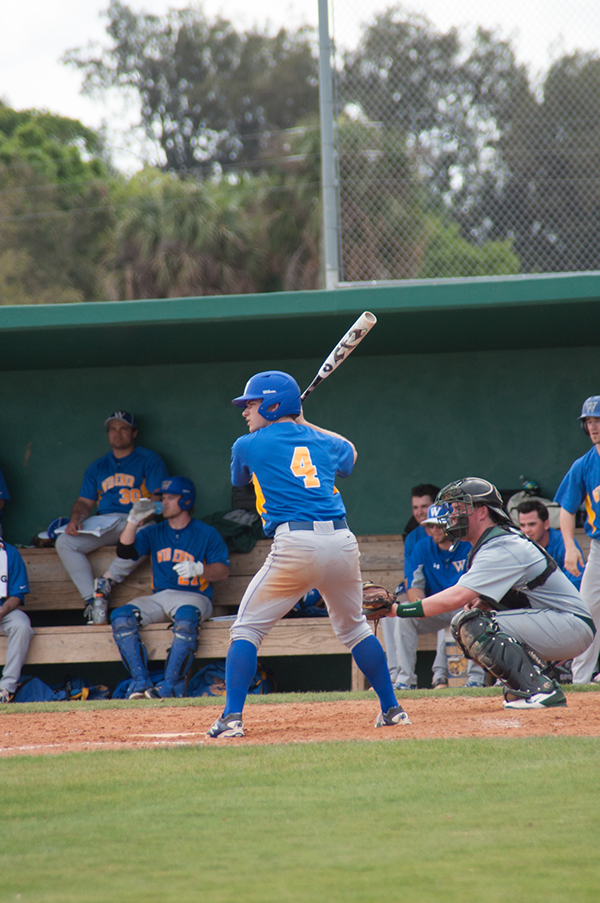
The width and height of the screenshot is (600, 903). Find the location of `bags under bench`. bags under bench is located at coordinates (201, 686), (58, 691).